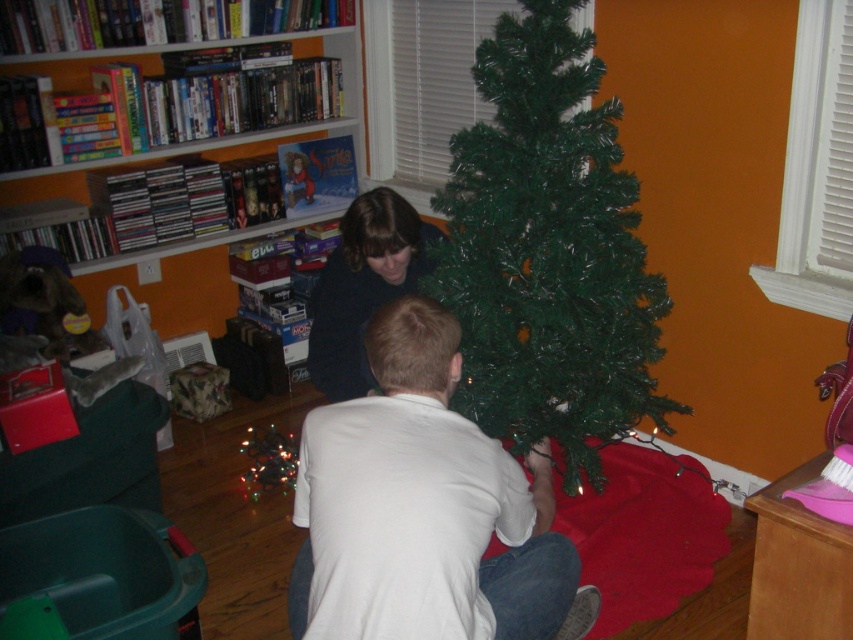
Question: Which of these objects is positioned farthest from the white matte shirt at center?

Choices:
 (A) wooden bookshelf at upper left
 (B) green artificial christmas tree at center

Answer: (A)

Question: Does green artificial christmas tree at center lie in front of wooden bookshelf at upper left?

Choices:
 (A) no
 (B) yes

Answer: (B)

Question: Which object is positioned closest to the wooden bookshelf at upper left?

Choices:
 (A) green artificial christmas tree at center
 (B) white matte shirt at center

Answer: (A)

Question: Is green artificial christmas tree at center behind white matte shirt at center?

Choices:
 (A) no
 (B) yes

Answer: (B)

Question: Can you confirm if green artificial christmas tree at center is thinner than white matte shirt at center?

Choices:
 (A) no
 (B) yes

Answer: (A)

Question: Which point is closer to the camera taking this photo?

Choices:
 (A) (24, 176)
 (B) (459, 602)

Answer: (B)